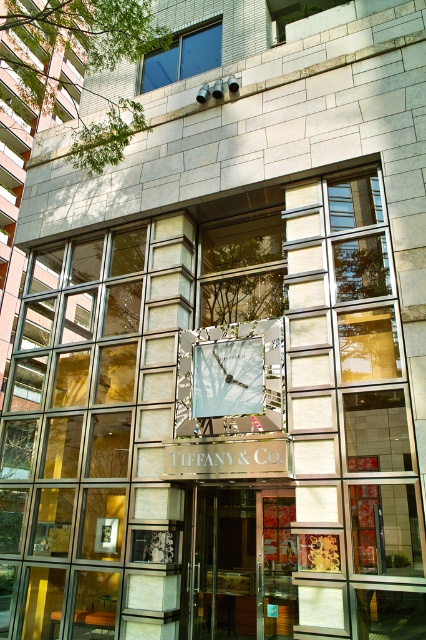
You are standing at the entrance of the Tiffany store and looking towards the upper part of the building. There are two points marked on the facade, one at point [244,518] and the other at point [193,400]. Which point is closer to you?

Point [193,400] is closer to you because it is in front of point [244,518].

Looking at this image, you are a delivery person trying to enter the Tiffany store. You see the transparent glass door at center and the matte silver clock at center. Which object is shorter?

The transparent glass door at center is shorter than the matte silver clock at center.

You are standing in front of the Tiffany store and want to enter. Which object should you pass under first, the transparent glass door at center or the matte silver clock at center?

You should pass under the matte silver clock at center first, as the transparent glass door at center is positioned under it.